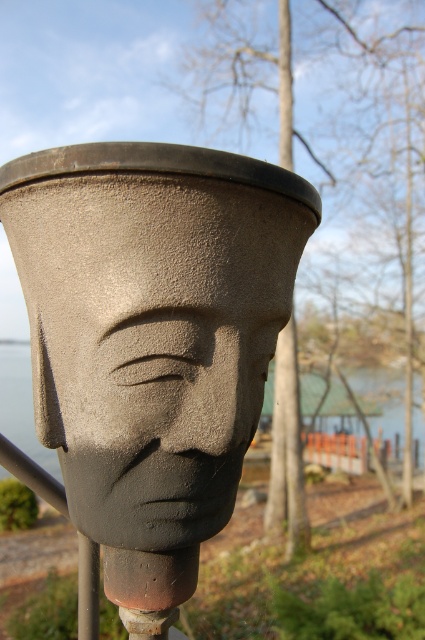
Is point (96, 392) closer to viewer compared to point (19, 353)?

Yes.

Is matte gray stone head at center shorter than gray stone water at center?

Correct, matte gray stone head at center is not as tall as gray stone water at center.

Is point (130, 356) positioned behind point (27, 412)?

That is False.

Identify the location of matte gray stone head at center. The image size is (425, 640). (155, 348).